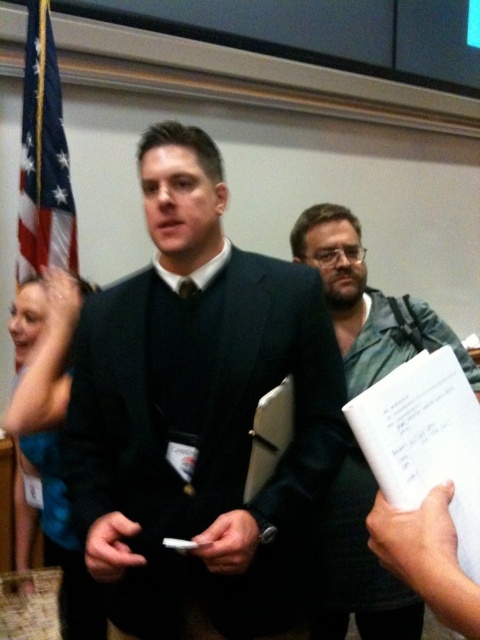
You are a photographer standing 40 inches away from the camera. You want to take a picture of the dark blue suit at center. Can you reach the camera to adjust it without moving closer?

The dark blue suit at center and camera are 37.98 inches apart. Since you are 40 inches away from the camera, you are slightly farther than the distance between the suit and the camera. You might need to move closer to adjust the camera effectively.

You are an event organizer arranging seating for a photo. You need to place the dark blue suit at center and the green textured shirt at center so that the shorter one is in front. Which should be placed in front?

The dark blue suit at center is shorter than the green textured shirt at center, so the dark blue suit at center should be placed in front.

You are organizing a photo shoot and need to ensure that the dark blue suit at center and the green textured shirt at center are visible in the frame. Given their sizes, which one might require more space to accommodate its width?

The dark blue suit at center has a greater width than the green textured shirt at center, so it would require more space to accommodate its width.